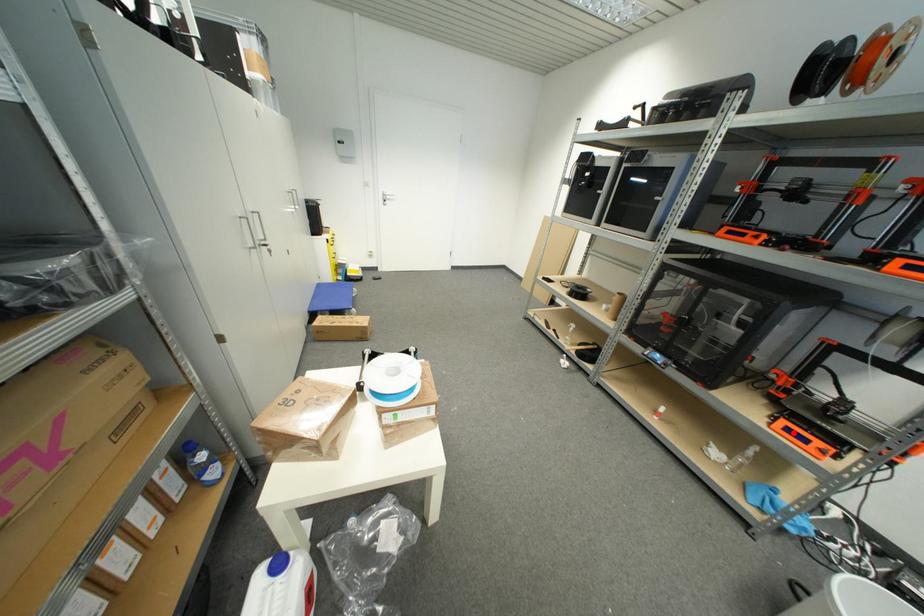
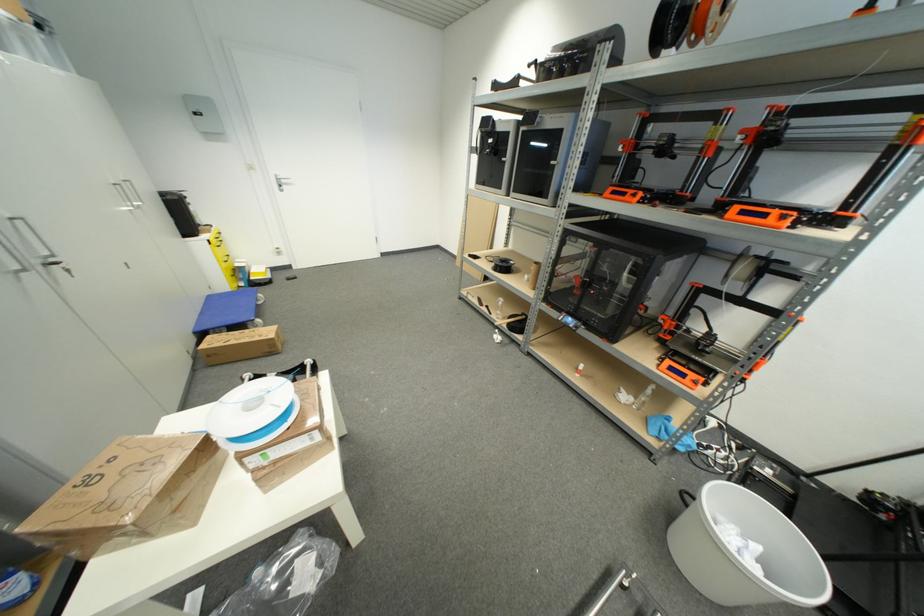
Find the pixel in the second image that matches the highlighted location in the first image.

(675, 371)